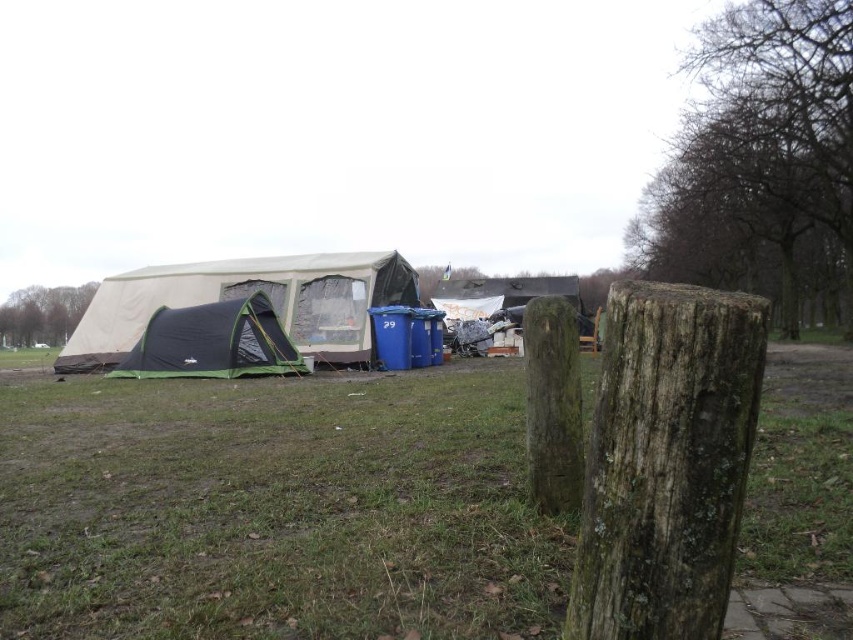
From the picture: Is green canvas tent at left taller than dark green fabric tent at center-left?

Correct, green canvas tent at left is much taller as dark green fabric tent at center-left.

Does point (352, 310) come closer to viewer compared to point (202, 332)?

No, (352, 310) is further to viewer.

The height and width of the screenshot is (640, 853). I want to click on green canvas tent at left, so click(x=245, y=296).

Is point (705, 586) positioned in front of point (547, 403)?

Yes, it is.

Which is below, weathered wood post at center or green mossy wood post at center?

Positioned lower is weathered wood post at center.

Which is behind, point (650, 545) or point (570, 380)?

The point (570, 380) is behind.

Identify the location of weathered wood post at center. The width and height of the screenshot is (853, 640). (666, 461).

Is point (287, 352) closer to camera compared to point (561, 442)?

No, it is not.

Is dark green fabric tent at center-left wider than green mossy wood post at center?

Yes.

Is point (248, 356) positioned behind point (563, 307)?

That is True.

Locate an element on the screen. The height and width of the screenshot is (640, 853). dark green fabric tent at center-left is located at coordinates (213, 342).